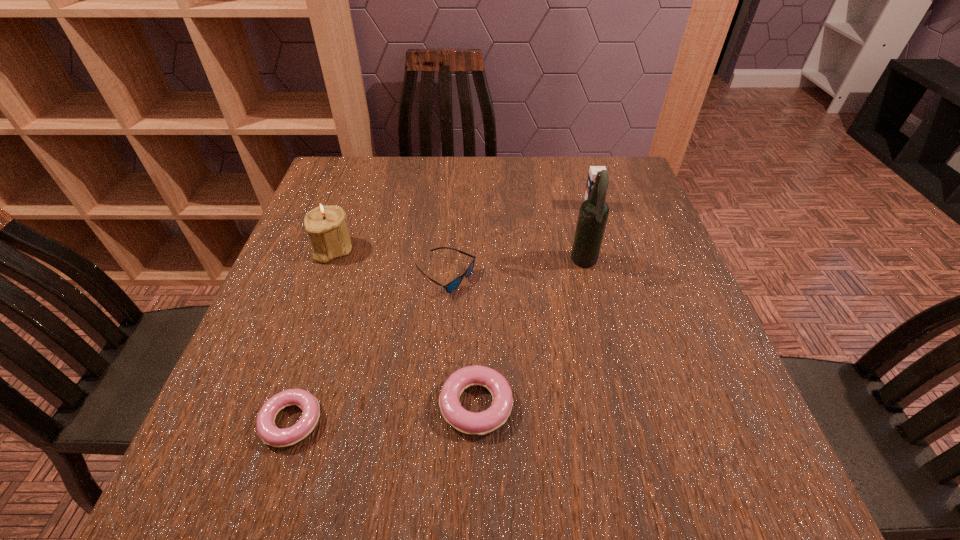
Locate an element on the screen. the shorter doughnut is located at coordinates (270, 434).

Where is `the taller doughnut`? Image resolution: width=960 pixels, height=540 pixels. the taller doughnut is located at coordinates (480, 423).

Locate an element on the screen. candle_holder is located at coordinates (326, 225).

You are a GUI agent. You are given a task and a screenshot of the screen. Output one action in this format:
    pyautogui.click(x=<x>, y=<y>)
    Task: Click on the chocolate milk
    Image resolution: width=960 pixels, height=540 pixels.
    Given the screenshot: What is the action you would take?
    pyautogui.click(x=593, y=170)

The height and width of the screenshot is (540, 960). In order to click on the rightmost object in this screenshot , I will do `click(593, 170)`.

What are the coordinates of `the second object from right to left` in the screenshot? It's located at (593, 214).

The image size is (960, 540). In order to click on the tallest object in this screenshot , I will do [593, 214].

Identify the location of sunglasses. (451, 286).

Find the location of a particular element. This screenshot has height=540, width=960. vacant space located 0.330m on the right of the shorter doughnut is located at coordinates (519, 422).

Find the location of `free space located on the left of the right doughnut`. free space located on the left of the right doughnut is located at coordinates tap(352, 405).